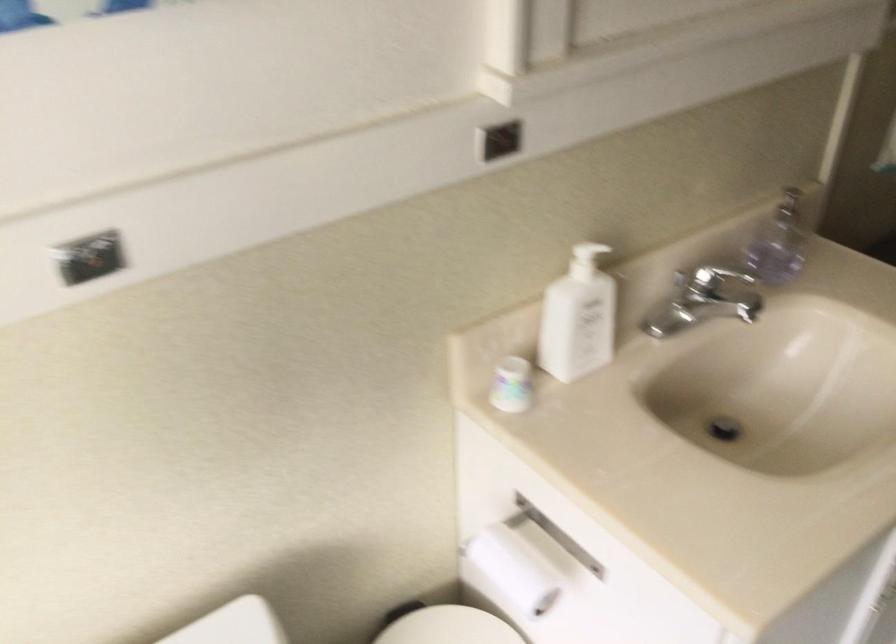
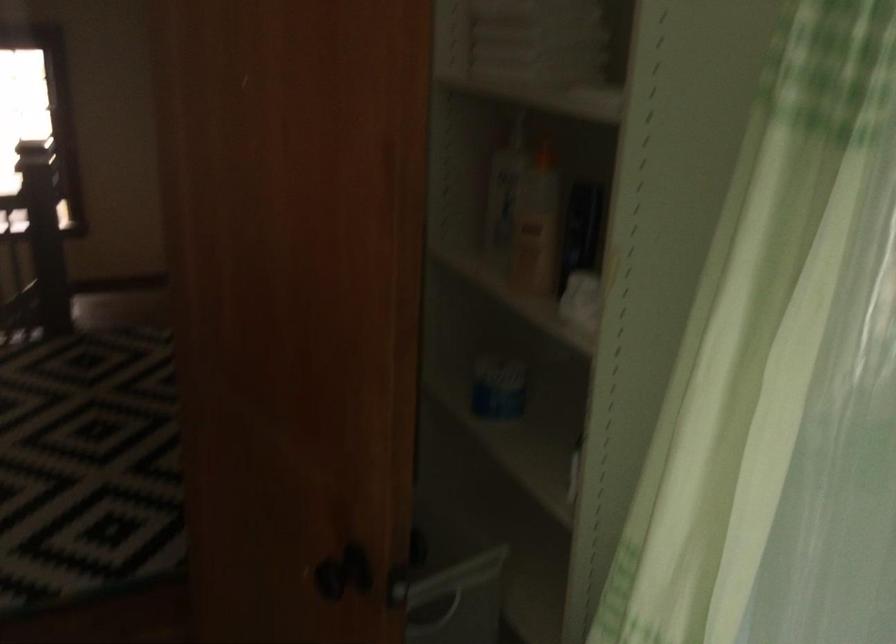
Question: The first image is from the beginning of the video and the second image is from the end. How did the camera likely rotate when shooting the video?

Choices:
 (A) Left
 (B) Right
 (C) Up
 (D) Down

Answer: (B)